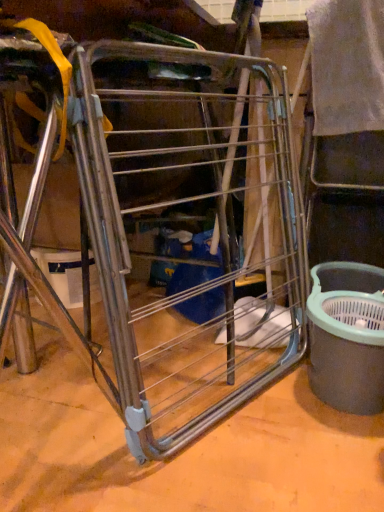
This screenshot has width=384, height=512. Identify the location of metal wire rack at center. (171, 222).

What do you see at coordinates (171, 222) in the screenshot?
I see `metal wire rack at center` at bounding box center [171, 222].

Describe the element at coordinates (347, 336) in the screenshot. This screenshot has height=512, width=384. I see `gray plastic bucket at right` at that location.

Consider the image. In order to face gray plastic bucket at right, should I rotate leftwards or rightwards?

To face it directly, rotate right by 20.308 degrees.

Where is `gray plastic bucket at right`? The image size is (384, 512). gray plastic bucket at right is located at coordinates (347, 336).

Where is `metal wire rack at center`? This screenshot has height=512, width=384. metal wire rack at center is located at coordinates (171, 222).

Considering the positions of objects metal wire rack at center and gray plastic bucket at right in the image provided, who is more to the right, metal wire rack at center or gray plastic bucket at right?

From the viewer's perspective, gray plastic bucket at right appears more on the right side.

From the picture: Is the depth of metal wire rack at center greater than that of gray plastic bucket at right?

That is False.

Is point (197, 165) closer to camera compared to point (356, 284)?

That is False.

From the image's perspective, is metal wire rack at center beneath gray plastic bucket at right?

No.

From a real-world perspective, between metal wire rack at center and gray plastic bucket at right, who is vertically higher?

metal wire rack at center, from a real-world perspective.

Is metal wire rack at center thinner than gray plastic bucket at right?

Correct, the width of metal wire rack at center is less than that of gray plastic bucket at right.

Which of these two, metal wire rack at center or gray plastic bucket at right, stands shorter?

Standing shorter between the two is gray plastic bucket at right.

Does metal wire rack at center have a smaller size compared to gray plastic bucket at right?

No, metal wire rack at center is not smaller than gray plastic bucket at right.

Is metal wire rack at center inside the boundaries of gray plastic bucket at right, or outside?

metal wire rack at center is not inside gray plastic bucket at right, it's outside.

Are metal wire rack at center and gray plastic bucket at right located far from each other?

That's not correct — metal wire rack at center is a little close to gray plastic bucket at right.

Is metal wire rack at center aimed at gray plastic bucket at right?

Yes, metal wire rack at center is facing gray plastic bucket at right.

How different are the orientations of metal wire rack at center and gray plastic bucket at right in degrees?

They differ by 60.5 degrees in their facing directions.

How distant is metal wire rack at center from gray plastic bucket at right?

metal wire rack at center is 15.11 inches away from gray plastic bucket at right.

I want to click on recycling bin below the metal wire rack at center (from the image's perspective), so click(347, 336).

Between gray plastic bucket at right and metal wire rack at center, which one appears on the left side from the viewer's perspective?

From the viewer's perspective, metal wire rack at center appears more on the left side.

Is the depth of gray plastic bucket at right less than that of metal wire rack at center?

No, the depth of gray plastic bucket at right is greater than that of metal wire rack at center.

Which is further, (381, 392) or (270, 85)?

Point (270, 85)

From the image's perspective, does gray plastic bucket at right appear lower than metal wire rack at center?

Yes, from the image's perspective, gray plastic bucket at right is below metal wire rack at center.

From a real-world perspective, is gray plastic bucket at right positioned over metal wire rack at center based on gravity?

No, from a real-world perspective, gray plastic bucket at right is not above metal wire rack at center.

Which of these two, gray plastic bucket at right or metal wire rack at center, is wider?

→ gray plastic bucket at right is wider.

From the picture: Considering the sizes of gray plastic bucket at right and metal wire rack at center in the image, is gray plastic bucket at right taller or shorter than metal wire rack at center?

Clearly, gray plastic bucket at right is shorter compared to metal wire rack at center.

Considering the relative sizes of gray plastic bucket at right and metal wire rack at center in the image provided, is gray plastic bucket at right bigger than metal wire rack at center?

Actually, gray plastic bucket at right might be smaller than metal wire rack at center.

Is gray plastic bucket at right located outside metal wire rack at center?

Indeed, gray plastic bucket at right is completely outside metal wire rack at center.

Is gray plastic bucket at right not close to metal wire rack at center?

No, gray plastic bucket at right is in close proximity to metal wire rack at center.

Is gray plastic bucket at right facing towards metal wire rack at center?

No.

What's the angular difference between gray plastic bucket at right and metal wire rack at center's facing directions?

60.5 degrees.

You are a GUI agent. You are given a task and a screenshot of the screen. Output one action in this format:
    pyautogui.click(x=<x>, y=<y>)
    Task: Click on the recycling bin located on the right of metal wire rack at center
    Image resolution: width=384 pixels, height=512 pixels.
    Given the screenshot: What is the action you would take?
    pyautogui.click(x=347, y=336)

Identify the location of recycling bin located on the right of metal wire rack at center. (347, 336).

At what (x,y) coordinates should I click in order to perform the action: click on furniture in front of the gray plastic bucket at right. Please return your answer as a coordinate pair (x, y). The width and height of the screenshot is (384, 512). Looking at the image, I should click on (171, 222).